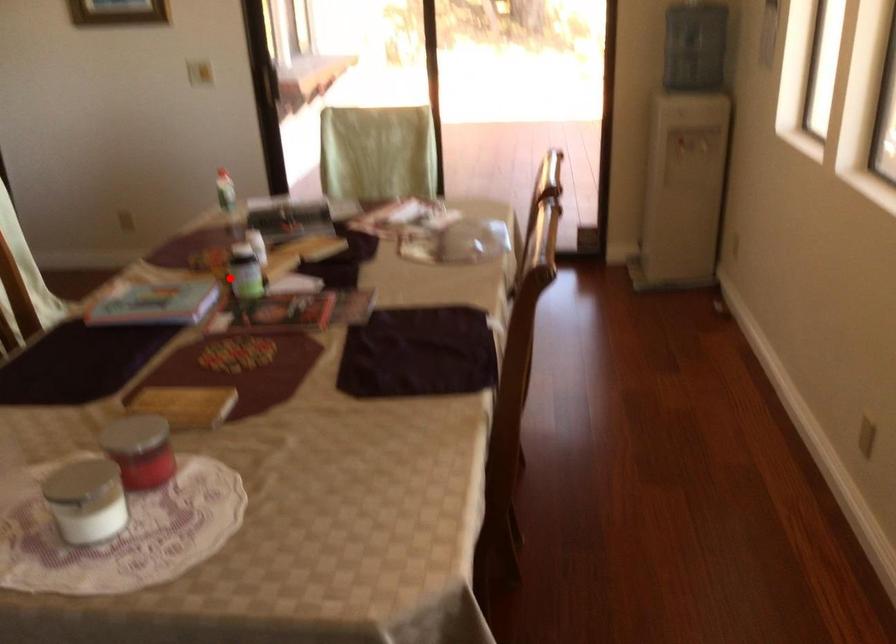
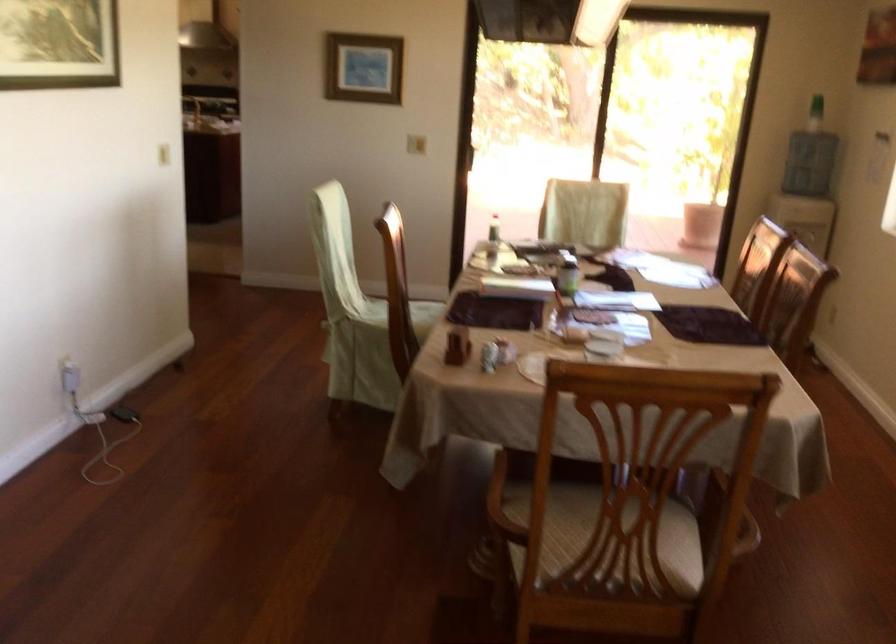
Find the pixel in the second image that matches the highlighted location in the first image.

(566, 272)